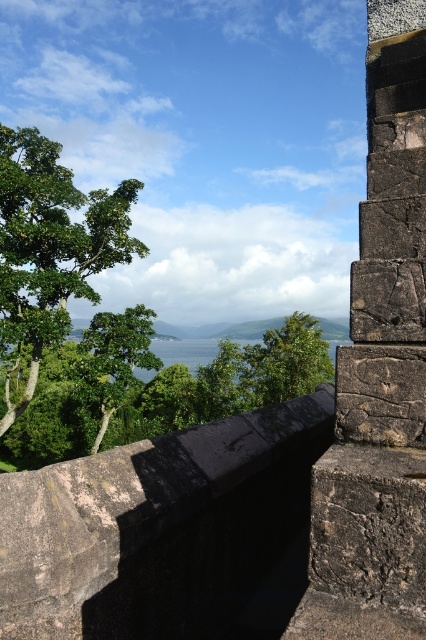
Between dark stone ledge at upper center and green leafy tree at center, which one appears on the right side from the viewer's perspective?

Positioned to the right is green leafy tree at center.

Does dark stone ledge at upper center appear on the right side of green leafy tree at center?

No, dark stone ledge at upper center is not to the right of green leafy tree at center.

I want to click on dark stone ledge at upper center, so click(158, 528).

Is green leafy tree at left to the right of green leafy tree at center from the viewer's perspective?

No, green leafy tree at left is not to the right of green leafy tree at center.

Image resolution: width=426 pixels, height=640 pixels. What do you see at coordinates (49, 252) in the screenshot? I see `green leafy tree at left` at bounding box center [49, 252].

The image size is (426, 640). What are the coordinates of `green leafy tree at left` in the screenshot? It's located at (49, 252).

What do you see at coordinates (158, 528) in the screenshot? I see `dark stone ledge at upper center` at bounding box center [158, 528].

Who is taller, dark stone ledge at upper center or green leafy tree at left?

green leafy tree at left

What do you see at coordinates (158, 528) in the screenshot? I see `dark stone ledge at upper center` at bounding box center [158, 528].

This screenshot has width=426, height=640. What are the coordinates of `dark stone ledge at upper center` in the screenshot? It's located at (158, 528).